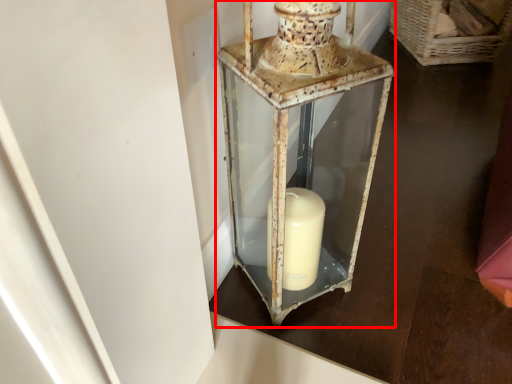
Question: Considering the relative positions of lantern (annotated by the red box) and basket in the image provided, where is lantern (annotated by the red box) located with respect to the staircase?

Choices:
 (A) right
 (B) left

Answer: (B)